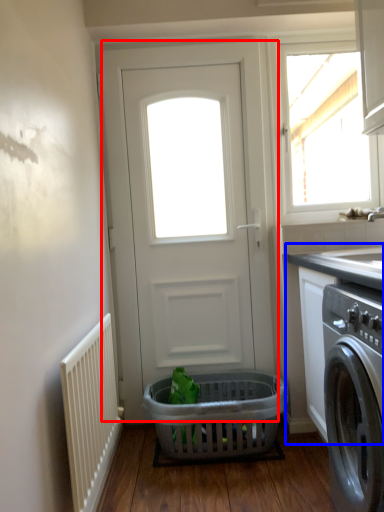
Question: Which object is further to the camera taking this photo, door (highlighted by a red box) or counter top (highlighted by a blue box)?

Choices:
 (A) door
 (B) counter top

Answer: (A)